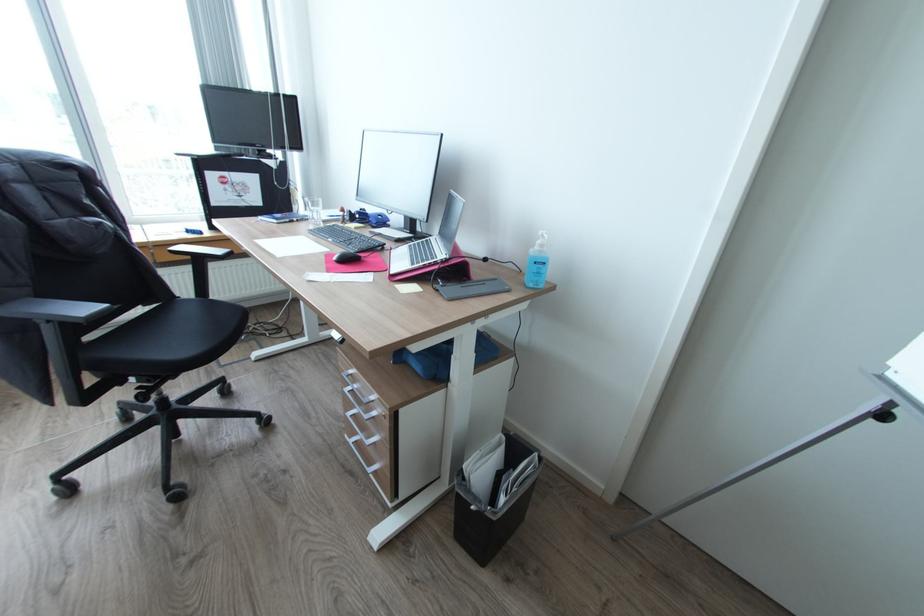
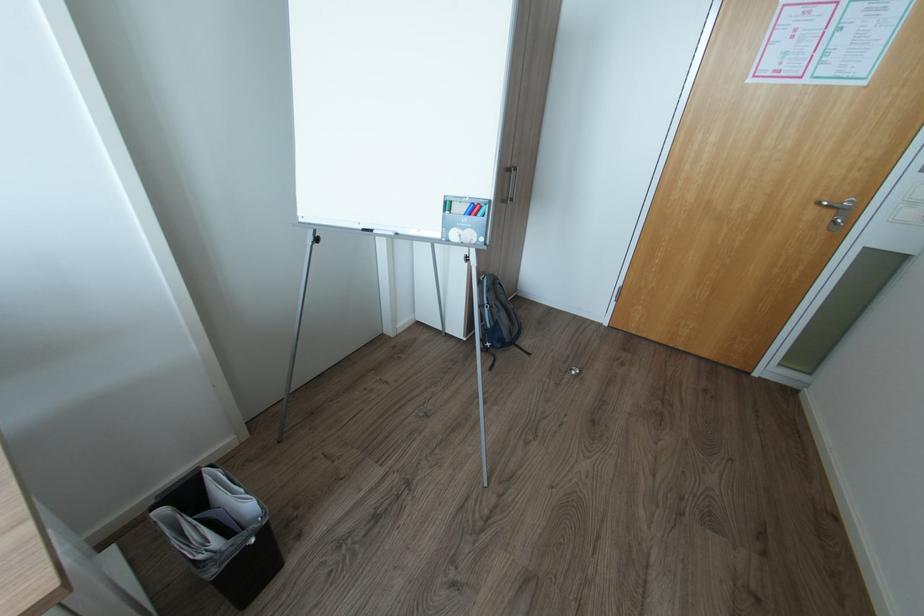
Where in the second image is the point corresponding to [477,507] from the first image?

(257, 541)